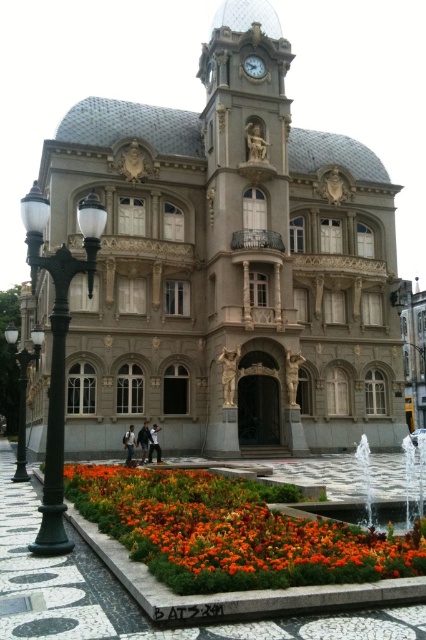
You are standing in front of the grand ornate building and want to locate the black metal lamp post at left and the gold metallic clock at upper center. Based on their positions, which object is closer to the left side of the building?

The black metal lamp post at left is positioned on the left side of the gold metallic clock at upper center, so it is closer to the left side of the building.

You are standing in front of the grand building and want to locate the black metal lamp post at left. According to the coordinates, where would you look relative to the building?

The black metal lamp post at left is located at point 0.608 on the x axis and 0.054 on the y axis relative to the building.